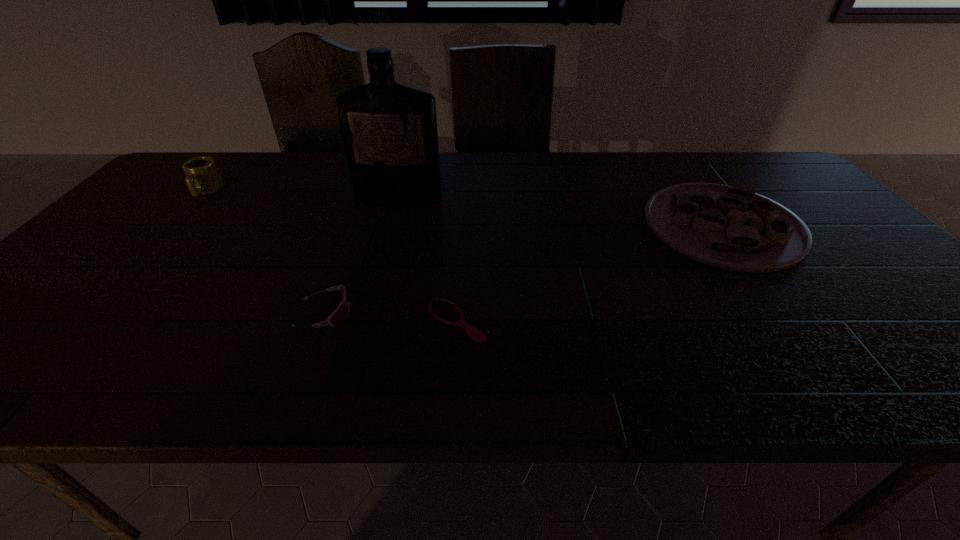
You are a GUI agent. You are given a task and a screenshot of the screen. Output one action in this format:
    pyautogui.click(x=<x>, y=<y>)
    Task: Click on the free region at the far right corner
    This screenshot has width=960, height=540.
    Given the screenshot: What is the action you would take?
    pyautogui.click(x=764, y=160)

I want to click on vacant point located between the liquor and the rightmost object, so click(561, 213).

You are a GUI agent. You are given a task and a screenshot of the screen. Output one action in this format:
    pyautogui.click(x=<x>, y=<y>)
    Task: Click on the vacant space in between the platter and the liquor
    The width and height of the screenshot is (960, 540).
    Given the screenshot: What is the action you would take?
    pyautogui.click(x=561, y=213)

This screenshot has width=960, height=540. Find the location of `free space between the fourth shortest object and the liquor`. free space between the fourth shortest object and the liquor is located at coordinates (302, 195).

Where is `vacant area that lies between the shortest object and the tallest object`? The image size is (960, 540). vacant area that lies between the shortest object and the tallest object is located at coordinates (427, 260).

Identify the location of free space between the fourth shortest object and the goggles. Image resolution: width=960 pixels, height=540 pixels. (266, 252).

The image size is (960, 540). I want to click on vacant space that is in between the goggles and the liquor, so click(362, 256).

This screenshot has width=960, height=540. Find the location of `vacant space that's between the tallest object and the leftmost object`. vacant space that's between the tallest object and the leftmost object is located at coordinates (302, 195).

At what (x,y) coordinates should I click in order to perform the action: click on free space that is in between the goggles and the fourth object from left to right. Please return your answer as a coordinate pair (x, y). Looking at the image, I should click on (391, 317).

The image size is (960, 540). I want to click on empty space that is in between the shortest object and the fourth tallest object, so click(391, 317).